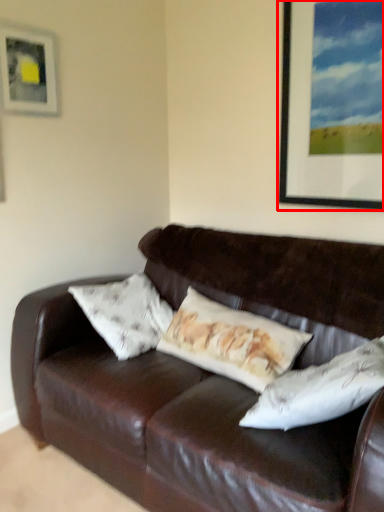
Question: From the image's perspective, what is the correct spatial positioning of picture frame (annotated by the red box) in reference to picture frame?

Choices:
 (A) below
 (B) above

Answer: (A)